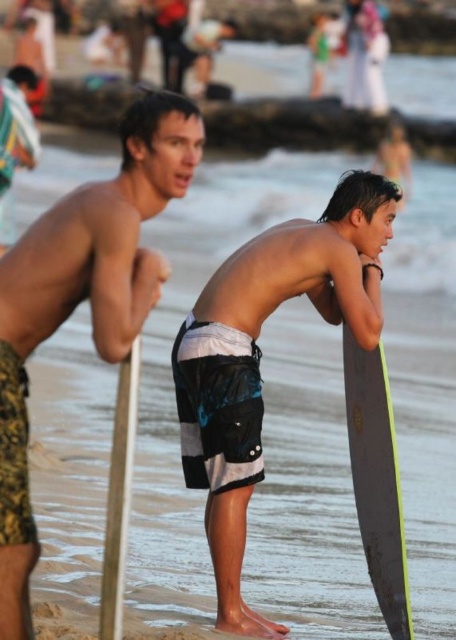
Who is lower down, camouflage-patterned shorts at left or wooden pole at lower left?

wooden pole at lower left

Does point (61, 208) lie in front of point (109, 470)?

That is True.

Is point (73, 298) more distant than point (114, 456)?

Yes.

Image resolution: width=456 pixels, height=640 pixels. I want to click on camouflage-patterned shorts at left, so (82, 300).

Does black matte surfboard at center have a larger size compared to camouflage-patterned shorts at left?

Yes, black matte surfboard at center is bigger than camouflage-patterned shorts at left.

Which is behind, point (224, 406) or point (139, 326)?

Point (224, 406)

Between point (373, 321) and point (149, 308), which one is positioned in front?

Point (149, 308) is in front.

At what (x,y) coordinates should I click in order to perform the action: click on black matte surfboard at center. Please return your answer as a coordinate pair (x, y). This screenshot has height=640, width=456. Looking at the image, I should click on (259, 356).

Does black matte surfboard at center appear under matte black surfboard at right?

No, black matte surfboard at center is not below matte black surfboard at right.

Which is above, black matte surfboard at center or matte black surfboard at right?

black matte surfboard at center is higher up.

Measure the distance between black matte surfboard at center and camera.

A distance of 6.35 meters exists between black matte surfboard at center and camera.

Locate an element on the screen. The image size is (456, 640). black matte surfboard at center is located at coordinates (259, 356).